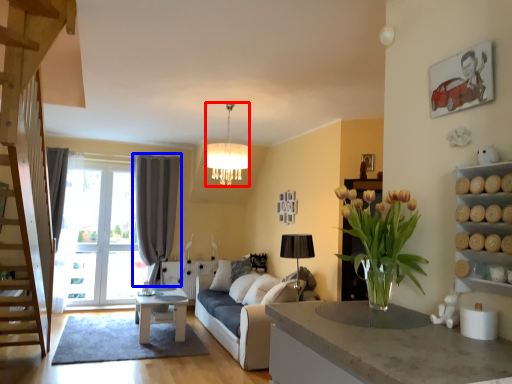
Question: Among these objects, which one is farthest to the camera, lamp (highlighted by a red box) or curtain (highlighted by a blue box)?

Choices:
 (A) lamp
 (B) curtain

Answer: (B)